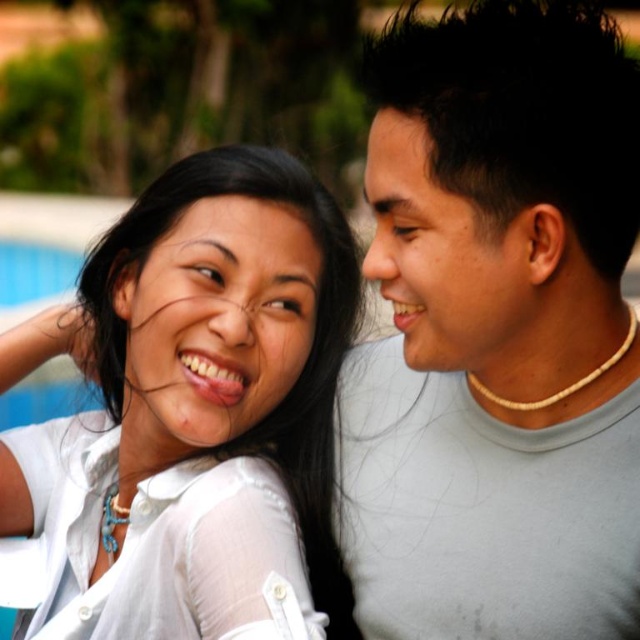
Measure the distance between gray matte shirt at center and white matte shirt at upper left.

gray matte shirt at center and white matte shirt at upper left are 14.08 inches apart.

Does point (564, 67) come closer to viewer compared to point (269, 449)?

Yes, point (564, 67) is in front of point (269, 449).

What are the coordinates of `gray matte shirt at center` in the screenshot? It's located at (497, 332).